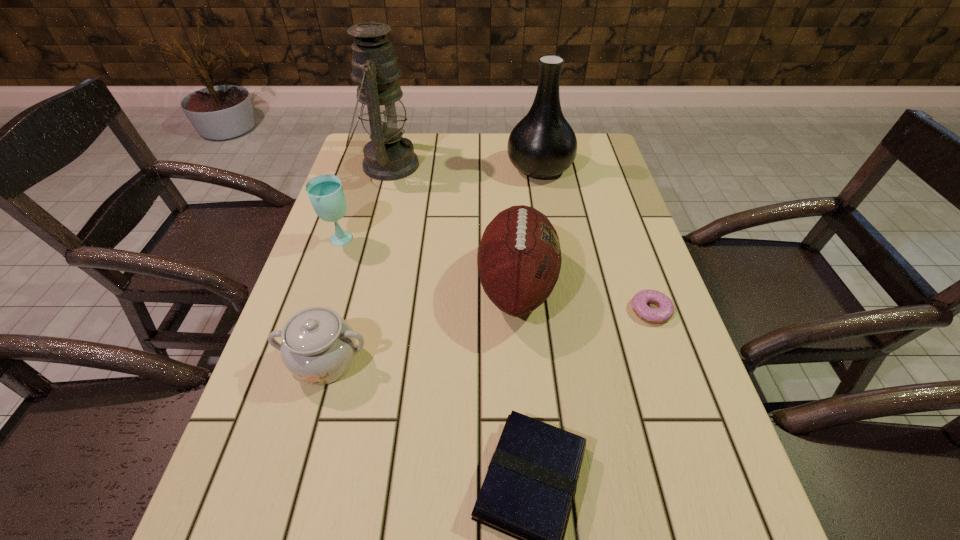
Identify which object is located as the second nearest to the football (American). Please provide its 2D coordinates. Your answer should be formatted as a tuple, i.e. [(x, y)], where the tuple contains the x and y coordinates of a point satisfying the conditions above.

[(529, 489)]

This screenshot has width=960, height=540. In order to click on object identified as the third closest to the glass in this screenshot , I will do coord(519,259).

This screenshot has height=540, width=960. I want to click on free space that satisfies the following two spatial constraints: 1. on the front side of the second tallest object; 2. on the left side of the oil lamp, so click(x=387, y=168).